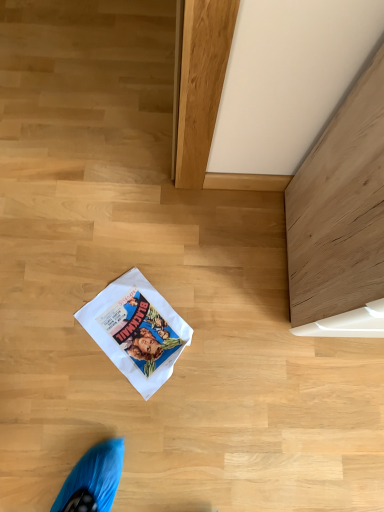
The width and height of the screenshot is (384, 512). What are the coordinates of `vacant point to the left of white paper comic book at center` in the screenshot? It's located at (54, 312).